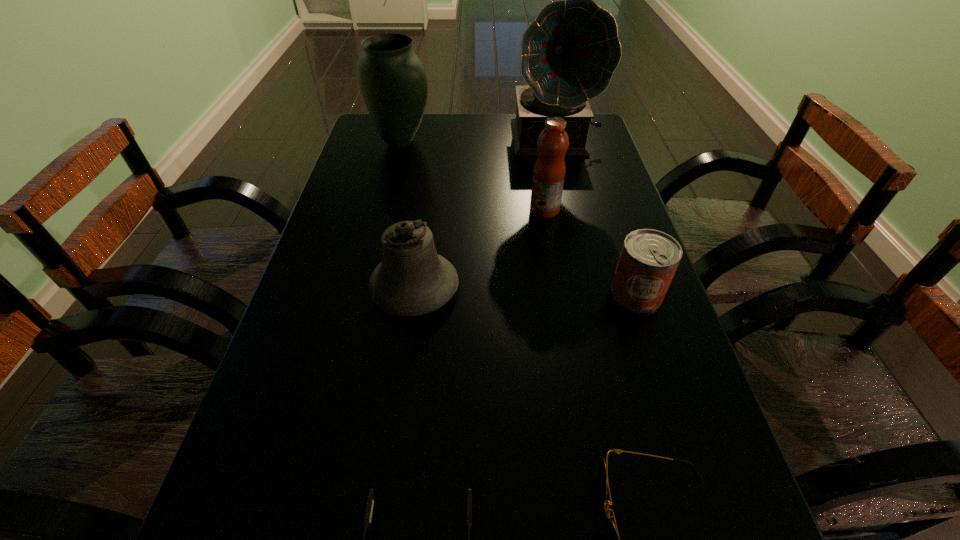
You are a GUI agent. You are given a task and a screenshot of the screen. Output one action in this format:
    pyautogui.click(x=<x>, y=<y>)
    Task: Click on the free space located 0.260m on the front label of the fruit juice
    This screenshot has height=540, width=960.
    Given the screenshot: What is the action you would take?
    pyautogui.click(x=429, y=210)

Locate an element on the screen. Image resolution: width=960 pixels, height=540 pixels. vacant space located 0.290m on the back of the bell is located at coordinates (429, 186).

At what (x,y) coordinates should I click in order to perform the action: click on free region located on the back of the can. Please return your answer as a coordinate pair (x, y). Looking at the image, I should click on (623, 254).

I want to click on record player located in the far edge section of the desktop, so click(x=570, y=51).

At what (x,y) coordinates should I click in order to perform the action: click on vase at the far edge. Please return your answer as a coordinate pair (x, y). The width and height of the screenshot is (960, 540). Looking at the image, I should click on (392, 79).

You are a GUI agent. You are given a task and a screenshot of the screen. Output one action in this format:
    pyautogui.click(x=<x>, y=<y>)
    Task: Click on the vase at the left edge
    This screenshot has height=540, width=960.
    Given the screenshot: What is the action you would take?
    pyautogui.click(x=392, y=79)

At what (x,y) coordinates should I click in order to perform the action: click on bell located at the left edge. Please return your answer as a coordinate pair (x, y). The image size is (960, 540). Looking at the image, I should click on (412, 280).

Locate an element on the screen. Image resolution: width=960 pixels, height=540 pixels. record player that is at the right edge is located at coordinates (570, 51).

At what (x,y) coordinates should I click in order to perform the action: click on can that is positioned at the right edge. Please return your answer as a coordinate pair (x, y). The height and width of the screenshot is (540, 960). Looking at the image, I should click on (649, 258).

What are the coordinates of `object at the far left corner` in the screenshot? It's located at (392, 79).